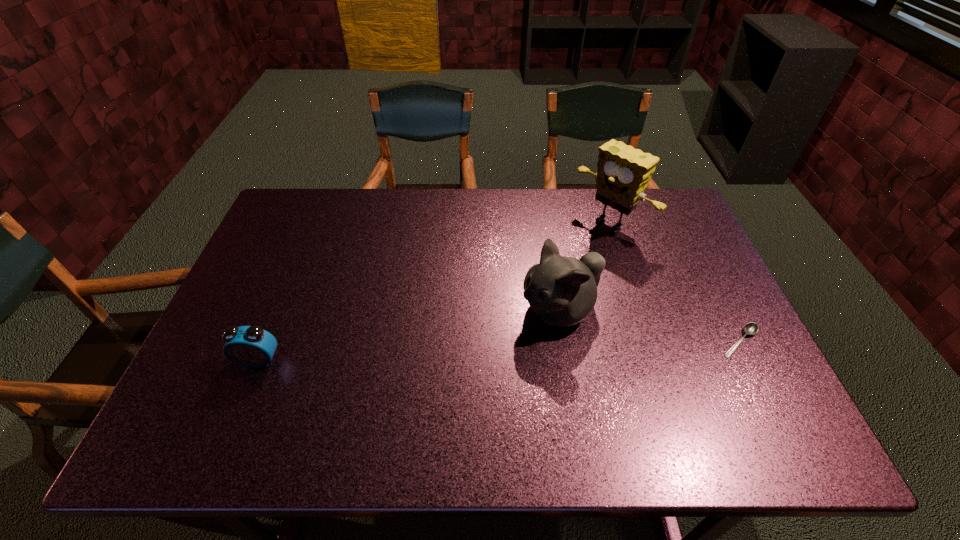
Locate an element on the screen. The image size is (960, 540). blank space located on the face of the second tallest object is located at coordinates (509, 336).

You are a GUI agent. You are given a task and a screenshot of the screen. Output one action in this format:
    pyautogui.click(x=<x>, y=<y>)
    Task: Click on the vacant space located on the face of the second tallest object
    The height and width of the screenshot is (540, 960).
    Given the screenshot: What is the action you would take?
    pyautogui.click(x=425, y=383)

Where is `blank space located on the front-facing side of the tallest object`? This screenshot has width=960, height=540. blank space located on the front-facing side of the tallest object is located at coordinates (578, 248).

The height and width of the screenshot is (540, 960). What are the coordinates of `vacant space positioned 0.100m on the front-facing side of the tallest object` in the screenshot? It's located at (570, 255).

This screenshot has width=960, height=540. I want to click on free space located 0.330m on the front-facing side of the tallest object, so click(518, 295).

Identify the location of object at the far edge. (623, 173).

This screenshot has width=960, height=540. I want to click on object that is at the left edge, so click(x=250, y=346).

Where is `soupspoon that is at the right edge`? The width and height of the screenshot is (960, 540). soupspoon that is at the right edge is located at coordinates (751, 328).

The image size is (960, 540). Identify the location of sponge present at the right edge. (623, 173).

The width and height of the screenshot is (960, 540). What are the coordinates of `object that is at the far right corner` in the screenshot? It's located at (623, 173).